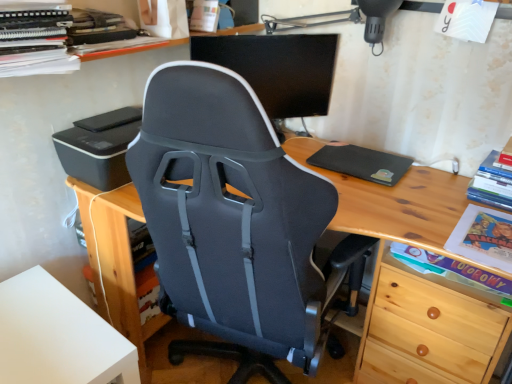
The image size is (512, 384). What are the coordinates of `free space in front of black matte/black rubberized mousepad at right` in the screenshot? It's located at (393, 198).